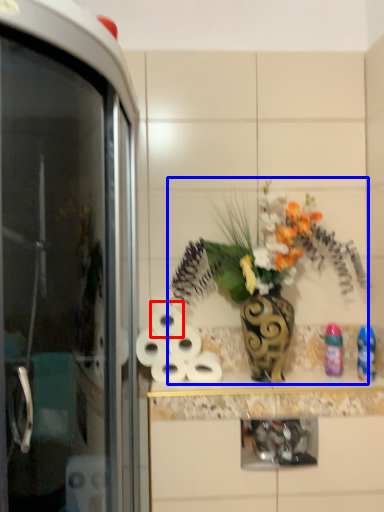
Question: Which of the following is the farthest to the observer, toilet paper (highlighted by a red box) or floral arrangement (highlighted by a blue box)?

Choices:
 (A) toilet paper
 (B) floral arrangement

Answer: (A)